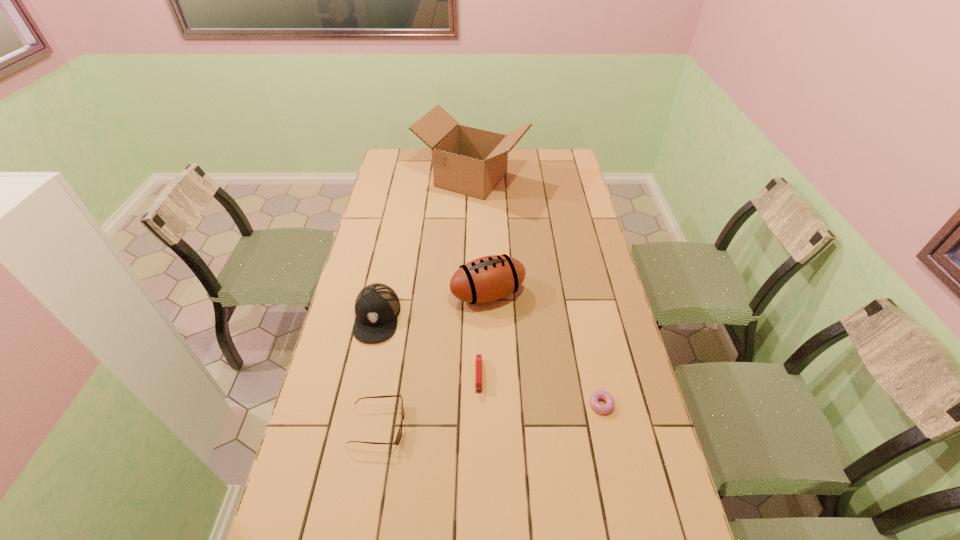
You are a GUI agent. You are given a task and a screenshot of the screen. Output one action in this format:
    pyautogui.click(x=<x>, y=<y>)
    Task: Click on the free space located on the front-facing side of the cap
    
    Given the screenshot: What is the action you would take?
    pyautogui.click(x=359, y=402)

You are a GUI agent. You are given a task and a screenshot of the screen. Output one action in this format:
    pyautogui.click(x=<x>, y=<y>)
    Task: Click on the free location located 0.290m on the front-facing side of the third nearest object
    The width and height of the screenshot is (960, 540).
    Given the screenshot: What is the action you would take?
    pyautogui.click(x=479, y=501)

Locate an element on the screen. This screenshot has width=960, height=540. free space located on the lenses of the sunglasses is located at coordinates (422, 426).

Locate an element on the screen. The width and height of the screenshot is (960, 540). vacant space located on the back of the rightmost object is located at coordinates (586, 325).

Where is `object located in the far edge section of the desktop`? object located in the far edge section of the desktop is located at coordinates click(469, 161).

At what (x,y) coordinates should I click in order to perform the action: click on box at the left edge. Please return your answer as a coordinate pair (x, y). The height and width of the screenshot is (540, 960). Looking at the image, I should click on (469, 161).

Find the location of a particular element. The width and height of the screenshot is (960, 540). cap present at the left edge is located at coordinates (377, 306).

I want to click on sunglasses situated at the left edge, so click(x=399, y=434).

At what (x,y) coordinates should I click in order to perform the action: click on object that is positioned at the right edge. Please return your answer as a coordinate pair (x, y). Image resolution: width=960 pixels, height=540 pixels. Looking at the image, I should click on (599, 394).

The height and width of the screenshot is (540, 960). What are the coordinates of `object that is at the far left corner` in the screenshot? It's located at (469, 161).